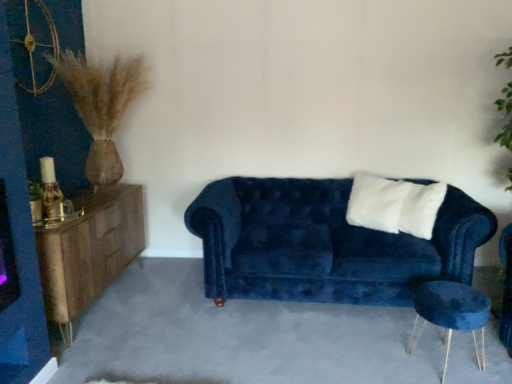
Where is `vacant position to the left of velvet blue side table at lower right`? The width and height of the screenshot is (512, 384). vacant position to the left of velvet blue side table at lower right is located at coordinates (384, 356).